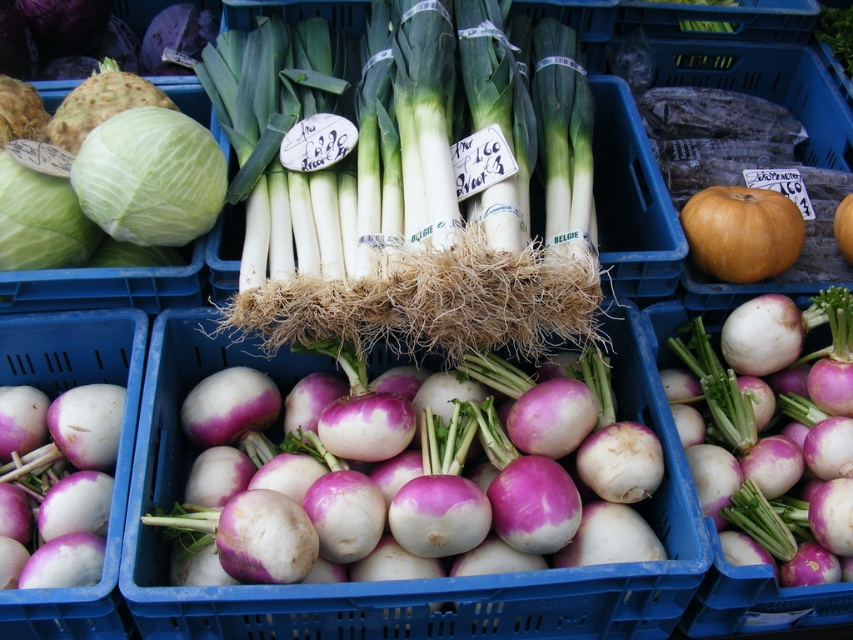
Question: From the image, what is the correct spatial relationship of purple matte turnip at center in relation to smooth white cabbage at left?

Choices:
 (A) right
 (B) left

Answer: (A)

Question: Which point is farther from the camera taking this photo?

Choices:
 (A) (123, 240)
 (B) (747, 472)

Answer: (B)

Question: Where is smooth white cabbage at left located in relation to matte orange pumpkin at center in the image?

Choices:
 (A) below
 (B) above

Answer: (B)

Question: Is purple matte turnip at center to the right of matte orange pumpkin at center from the viewer's perspective?

Choices:
 (A) yes
 (B) no

Answer: (A)

Question: Which point is farther to the camera?

Choices:
 (A) (799, 442)
 (B) (169, 182)

Answer: (A)

Question: Which object is positioned closest to the green matte cabbage at upper left?

Choices:
 (A) smooth white cabbage at left
 (B) matte orange pumpkin at center
 (C) purple matte turnip at center

Answer: (A)